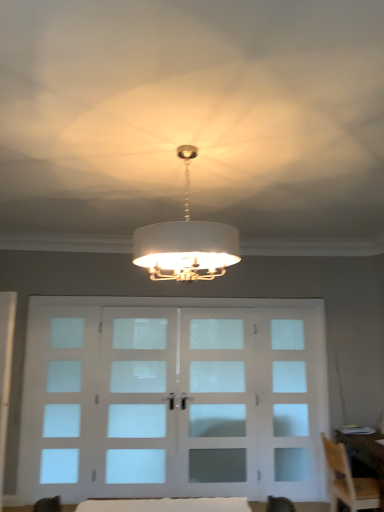
Question: Can you confirm if clear glass door at center, placed as the first screen door when sorted from right to left, is taller than white fabric table at lower center?

Choices:
 (A) yes
 (B) no

Answer: (A)

Question: Is clear glass door at center, acting as the 2th screen door starting from the left, thinner than white fabric table at lower center?

Choices:
 (A) no
 (B) yes

Answer: (B)

Question: Is clear glass door at center, acting as the 2th screen door starting from the left, facing towards white fabric table at lower center?

Choices:
 (A) no
 (B) yes

Answer: (B)

Question: Is clear glass door at center, placed as the first screen door when sorted from right to left, at the left side of white fabric table at lower center?

Choices:
 (A) yes
 (B) no

Answer: (B)

Question: Considering the relative positions of clear glass door at center, acting as the 2th screen door starting from the left, and white fabric table at lower center in the image provided, is clear glass door at center, acting as the 2th screen door starting from the left, behind white fabric table at lower center?

Choices:
 (A) yes
 (B) no

Answer: (A)

Question: Does clear glass door at center, placed as the first screen door when sorted from right to left, have a greater width compared to white fabric table at lower center?

Choices:
 (A) yes
 (B) no

Answer: (B)

Question: Can you confirm if frosted glass window at left is positioned to the left of white fabric table at lower center?

Choices:
 (A) yes
 (B) no

Answer: (A)

Question: From a real-world perspective, is frosted glass window at left positioned over white fabric table at lower center based on gravity?

Choices:
 (A) yes
 (B) no

Answer: (A)

Question: Is the depth of frosted glass window at left less than that of white fabric table at lower center?

Choices:
 (A) no
 (B) yes

Answer: (A)

Question: Is frosted glass window at left turned away from white fabric table at lower center?

Choices:
 (A) yes
 (B) no

Answer: (B)

Question: Is frosted glass window at left directly adjacent to white fabric table at lower center?

Choices:
 (A) no
 (B) yes

Answer: (A)

Question: From the image's perspective, is frosted glass window at left over white fabric table at lower center?

Choices:
 (A) yes
 (B) no

Answer: (B)

Question: Is frosted glass window at left located within white fabric lampshade at center?

Choices:
 (A) no
 (B) yes

Answer: (A)